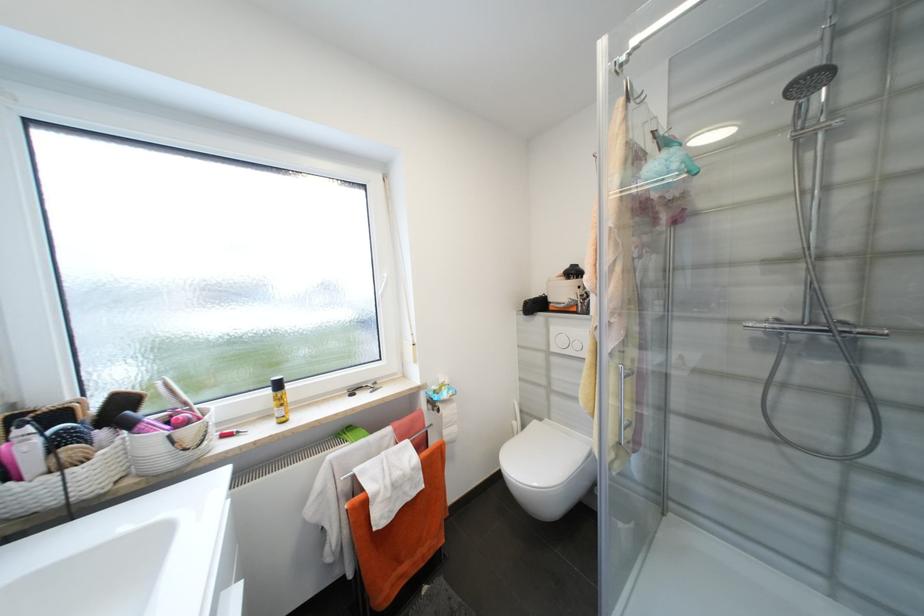
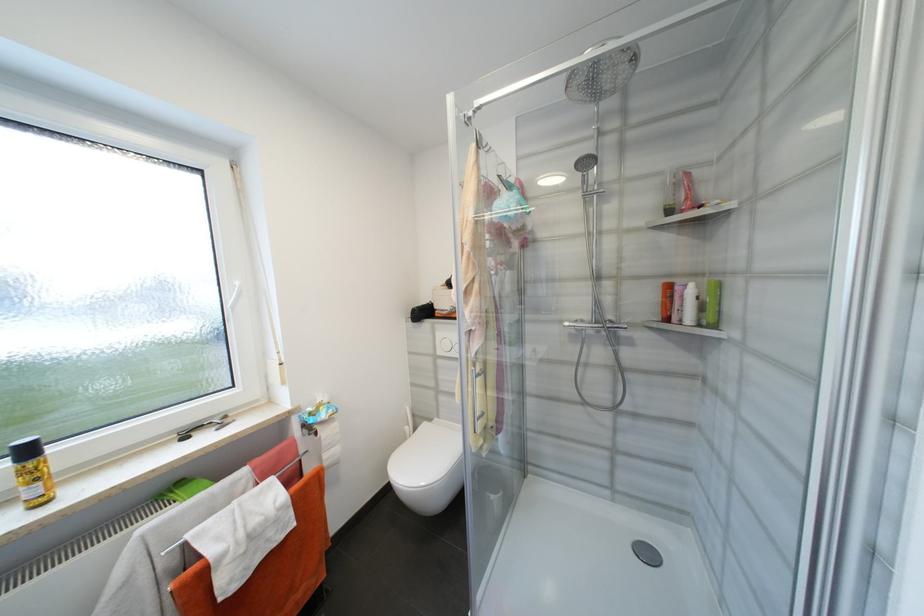
Locate, in the second image, the point that corresponds to pixel 550 347 in the first image.

(436, 352)